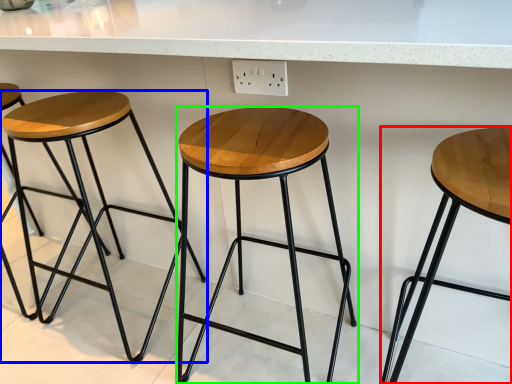
Question: Considering the real-world distances, which object is closest to stool (highlighted by a red box)? stool (highlighted by a blue box) or stool (highlighted by a green box).

Choices:
 (A) stool
 (B) stool

Answer: (B)